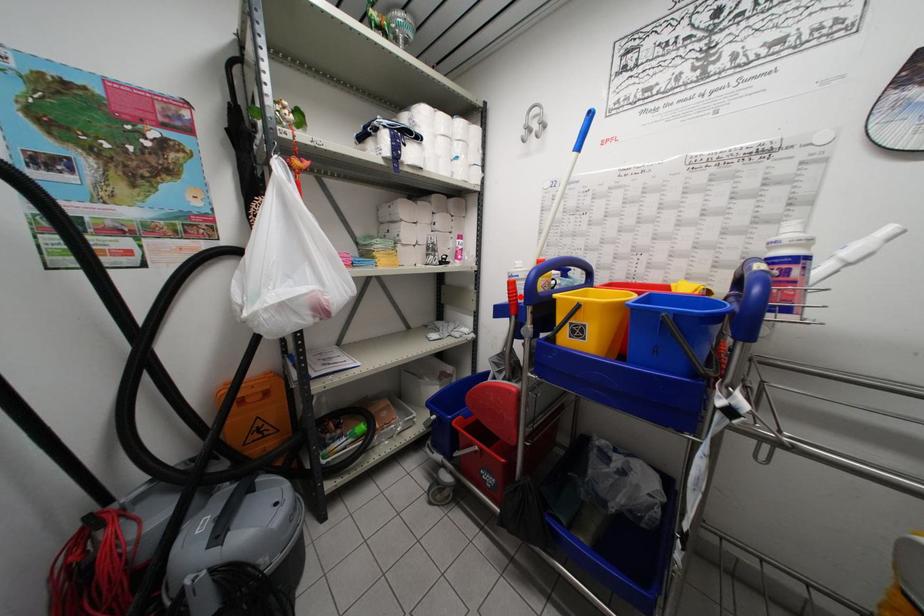
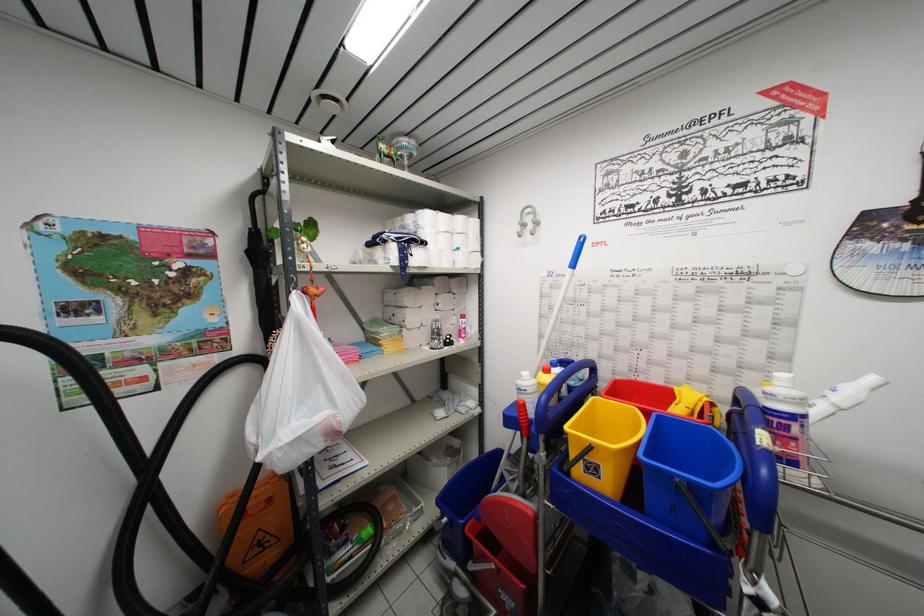
In the second image, find the point that corresponds to the highlighted location in the first image.

(530, 419)